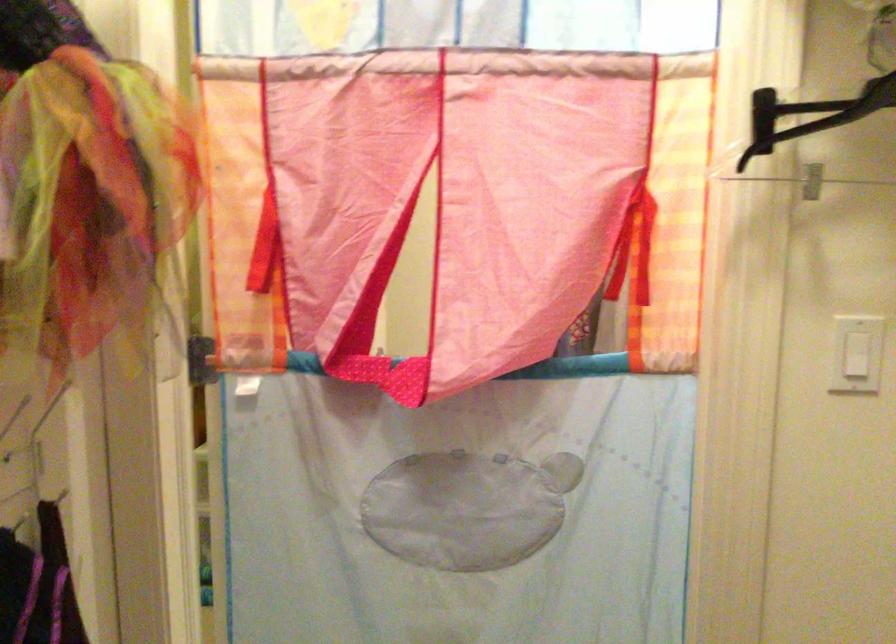
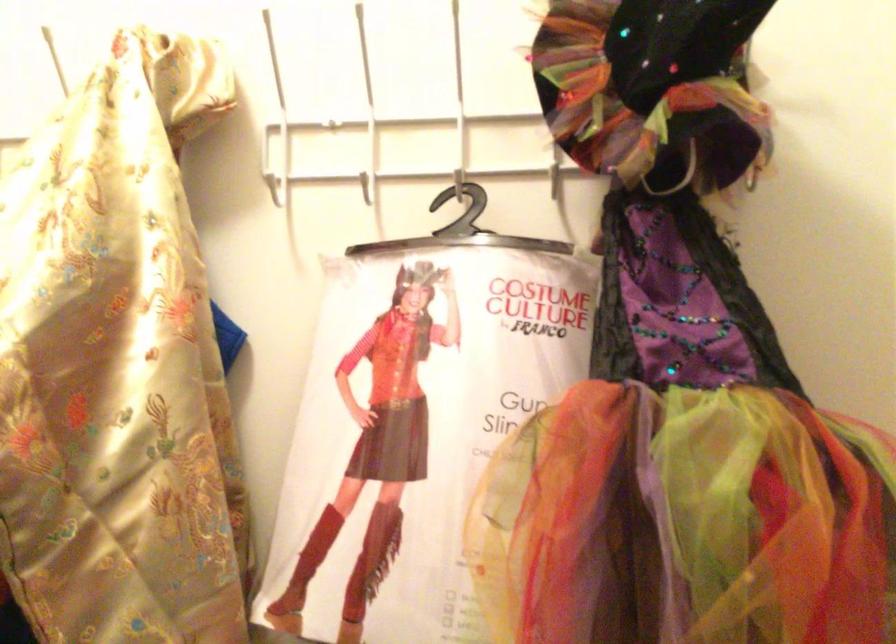
Question: Based on the continuous images, in which direction is the camera rotating? Reply with the corresponding letter.

Choices:
 (A) Left
 (B) Right
 (C) Up
 (D) Down

Answer: (A)